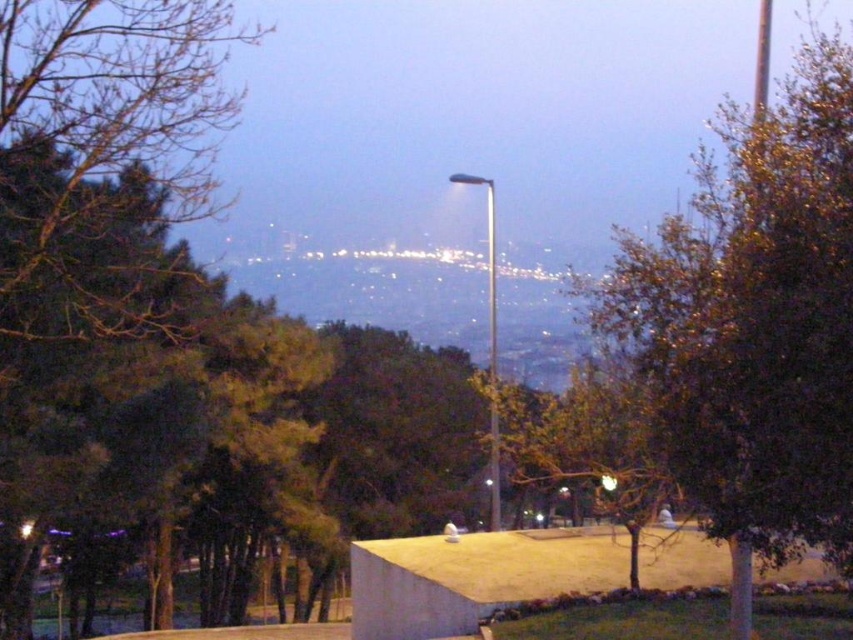
You are standing in the plaza and want to take a photo of the silver metallic street light at center without the green leafy tree at center blocking it. Which direction should you move to ensure the tree is out of frame?

Move to the left side of the silver metallic street light at center so that the green leafy tree at center, which is on the right side of the street light, is no longer blocking the view.

You are standing at the elevated viewpoint overlooking the city and see two points marked on the image. The first point is at coordinate point (x=735, y=214) and the second is at point (x=494, y=497). Which point is closer to you?

Point (x=735, y=214) is in front of point (x=494, y=497), so the first point is closer to you.

You are standing at the viewpoint overlooking the city and notice a point marked at coordinates (x=756, y=321). What object is located at this point?

The point at coordinates (x=756, y=321) is where the green leafy tree at center is located.